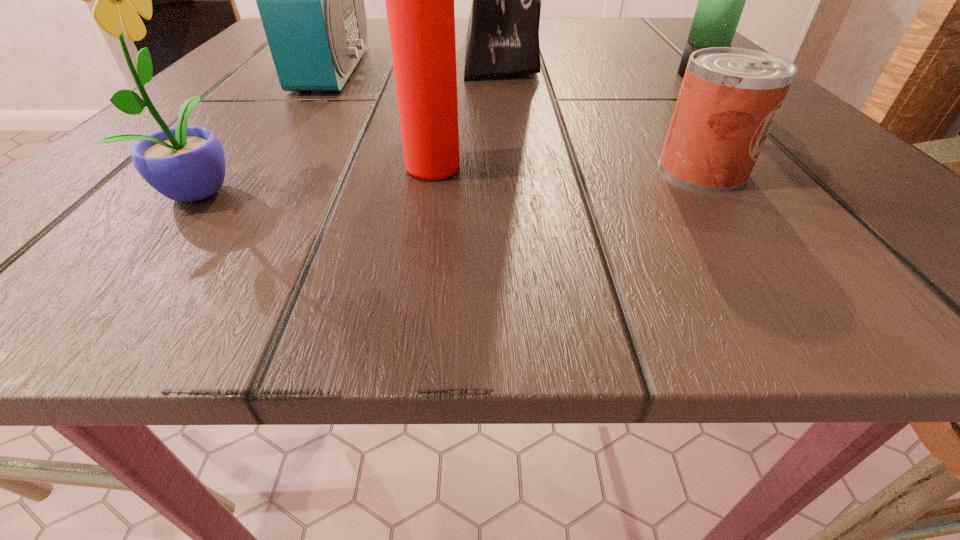
Find the location of a particular element. free point between the can and the radio receiver is located at coordinates (517, 119).

You are a GUI agent. You are given a task and a screenshot of the screen. Output one action in this format:
    pyautogui.click(x=<x>, y=<y>)
    Task: Click on the vacant area between the sunflower and the fifth object from left to right
    This screenshot has height=540, width=960.
    Given the screenshot: What is the action you would take?
    pyautogui.click(x=452, y=179)

At what (x,y) coordinates should I click in order to perform the action: click on unoccupied area between the radio receiver and the sunflower. Please return your answer as a coordinate pair (x, y). Looking at the image, I should click on (267, 129).

The height and width of the screenshot is (540, 960). Find the location of `vacant region between the second object from right to left and the sunflower`. vacant region between the second object from right to left and the sunflower is located at coordinates (452, 179).

Find the location of a particular element. the third closest object relative to the left thermos bottle is located at coordinates (729, 98).

Select which object appears as the fourth closest to the rightmost object. Please provide its 2D coordinates. Your answer should be formatted as a tuple, i.e. [(x, y)], where the tuple contains the x and y coordinates of a point satisfying the conditions above.

[(311, 0)]

This screenshot has width=960, height=540. Find the location of `vacant area that satisfies the following two spatial constraints: 1. on the back side of the can; 2. on the left side of the farther thermos bottle`. vacant area that satisfies the following two spatial constraints: 1. on the back side of the can; 2. on the left side of the farther thermos bottle is located at coordinates (633, 75).

At what (x,y) coordinates should I click in order to perform the action: click on free location that satisfies the following two spatial constraints: 1. on the front of the can with the design; 2. on the left side of the shopping bag. Please return your answer as a coordinate pair (x, y). The width and height of the screenshot is (960, 540). Looking at the image, I should click on (511, 170).

Where is `free space that satisfies the following two spatial constraints: 1. on the front panel of the shortest object; 2. on the left side of the radio receiver`? free space that satisfies the following two spatial constraints: 1. on the front panel of the shortest object; 2. on the left side of the radio receiver is located at coordinates (260, 170).